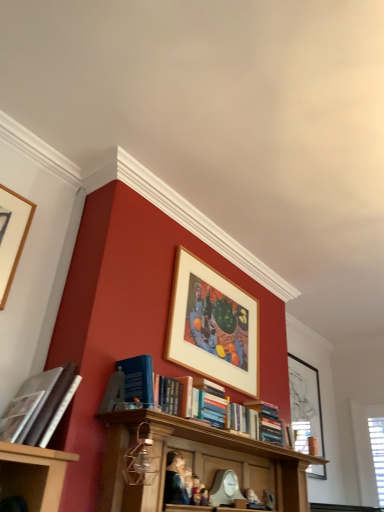
In order to face hardcover book at center, arranged as the 2th book when viewed from the top, should I rotate leftwards or rightwards?

Rotate right and turn 9.964 degrees.

Find the location of a particular element. Image resolution: width=384 pixels, height=512 pixels. black matte picture frame at upper right, which ranks as the 1th picture frame in right-to-left order is located at coordinates (305, 405).

Image resolution: width=384 pixels, height=512 pixels. What do you see at coordinates (175, 480) in the screenshot?
I see `smooth canvas portrait at center, positioned as the 2th person in right-to-left order` at bounding box center [175, 480].

What do you see at coordinates (198, 492) in the screenshot? This screenshot has height=512, width=384. I see `smooth plastic figurine at center, which appears as the first person when viewed from the right` at bounding box center [198, 492].

Where is `smooth plastic figurine at center, positioned as the 2th person in left-to-right order`? smooth plastic figurine at center, positioned as the 2th person in left-to-right order is located at coordinates (198, 492).

What are the coordinates of `hardcover book at center, arranged as the 2th book when viewed from the top` in the screenshot? It's located at (268, 421).

Is hardcover book at center, positioned as the first book in bottom-to-top order, shorter than wooden picture frame at upper center, the 2th picture frame in the back-to-front sequence?

Indeed, hardcover book at center, positioned as the first book in bottom-to-top order, has a lesser height compared to wooden picture frame at upper center, the 2th picture frame in the back-to-front sequence.

Does hardcover book at center, which is counted as the second book, starting from the left, have a smaller size compared to wooden picture frame at upper center, which is the second picture frame from front to back?

Correct, hardcover book at center, which is counted as the second book, starting from the left, occupies less space than wooden picture frame at upper center, which is the second picture frame from front to back.

Is point (272, 433) farther from camera compared to point (228, 340)?

No, (272, 433) is in front of (228, 340).

From the image's perspective, which one is positioned higher, hardcover book at center, which ranks as the first book in back-to-front order, or wooden picture frame at upper center, the 2th picture frame in the back-to-front sequence?

wooden picture frame at upper center, the 2th picture frame in the back-to-front sequence.

Does hardcover book at left, which is the 2th book in back-to-front order, contain black matte picture frame at upper right, which is counted as the 1th picture frame, starting from the back?

Definitely not — black matte picture frame at upper right, which is counted as the 1th picture frame, starting from the back, is not inside hardcover book at left, which is the 2th book in back-to-front order.

Considering the relative sizes of hardcover book at left, which is the 2th book in back-to-front order, and black matte picture frame at upper right, which ranks as the 1th picture frame in right-to-left order, in the image provided, is hardcover book at left, which is the 2th book in back-to-front order, thinner than black matte picture frame at upper right, which ranks as the 1th picture frame in right-to-left order,?

No, hardcover book at left, which is the 2th book in back-to-front order, is not thinner than black matte picture frame at upper right, which ranks as the 1th picture frame in right-to-left order.

Does point (45, 392) come closer to viewer compared to point (316, 396)?

Yes, point (45, 392) is closer to viewer.

From the image's perspective, which one is positioned higher, hardcover book at left, the 2th book viewed from the right, or black matte picture frame at upper right, which is counted as the 1th picture frame, starting from the back?

hardcover book at left, the 2th book viewed from the right.

From the picture: Between wooden picture frame at upper center, which is the second picture frame from front to back, and smooth plastic figurine at center, which appears as the first person when viewed from the right, which one has smaller size?

Smaller between the two is smooth plastic figurine at center, which appears as the first person when viewed from the right.

Consider the image. Is wooden picture frame at upper center, the 2th picture frame in the back-to-front sequence, oriented towards smooth plastic figurine at center, which appears as the first person when viewed from the right?

No, wooden picture frame at upper center, the 2th picture frame in the back-to-front sequence, is not facing towards smooth plastic figurine at center, which appears as the first person when viewed from the right.

Would you say wooden picture frame at upper center, which is the second picture frame from left to right, contains smooth plastic figurine at center, which appears as the first person when viewed from the right?

That's incorrect, smooth plastic figurine at center, which appears as the first person when viewed from the right, is not inside wooden picture frame at upper center, which is the second picture frame from left to right.

How many degrees apart are the facing directions of wooden picture frame at upper center, positioned as the second picture frame in right-to-left order, and smooth plastic figurine at center, positioned as the 2th person in left-to-right order?

The angle between the facing direction of wooden picture frame at upper center, positioned as the second picture frame in right-to-left order, and the facing direction of smooth plastic figurine at center, positioned as the 2th person in left-to-right order, is 0.684 degrees.

Considering the relative sizes of hardcover book at left, the 2th book ordered from the bottom, and smooth canvas portrait at center, acting as the 1th person starting from the left, in the image provided, is hardcover book at left, the 2th book ordered from the bottom, bigger than smooth canvas portrait at center, acting as the 1th person starting from the left,?

Yes.

Is hardcover book at left, which is the 2th book in back-to-front order, facing away from smooth canvas portrait at center, acting as the 1th person starting from the left?

No, hardcover book at left, which is the 2th book in back-to-front order,'s orientation is not away from smooth canvas portrait at center, acting as the 1th person starting from the left.

Which is correct: hardcover book at left, the 2th book ordered from the bottom, is inside smooth canvas portrait at center, positioned as the 2th person in right-to-left order, or outside of it?

The correct answer is: outside.

Can you see hardcover book at left, marked as the 1th book in a left-to-right arrangement, touching smooth canvas portrait at center, acting as the 1th person starting from the left?

No, hardcover book at left, marked as the 1th book in a left-to-right arrangement, is not making contact with smooth canvas portrait at center, acting as the 1th person starting from the left.

Are smooth plastic figurine at center, which appears as the first person when viewed from the right, and hardcover book at center, the 1th book viewed from the right, located far from each other?

smooth plastic figurine at center, which appears as the first person when viewed from the right, is near hardcover book at center, the 1th book viewed from the right, not far away.

Considering the relative sizes of smooth plastic figurine at center, which appears as the first person when viewed from the right, and hardcover book at center, which ranks as the first book in back-to-front order, in the image provided, is smooth plastic figurine at center, which appears as the first person when viewed from the right, smaller than hardcover book at center, which ranks as the first book in back-to-front order,?

Yes.

From a real-world perspective, who is located higher, smooth plastic figurine at center, positioned as the 2th person in left-to-right order, or hardcover book at center, arranged as the 2th book when viewed from the front?

From a 3D spatial view, hardcover book at center, arranged as the 2th book when viewed from the front, is above.

Are wooden picture frame at upper center, which is the second picture frame from left to right, and hardcover book at left, the 2th book ordered from the bottom, far apart?

wooden picture frame at upper center, which is the second picture frame from left to right, is actually quite close to hardcover book at left, the 2th book ordered from the bottom.

Is wooden picture frame at upper center, positioned as the second picture frame in right-to-left order, positioned beyond the bounds of hardcover book at left, which is the 2th book in back-to-front order?

Yes, wooden picture frame at upper center, positioned as the second picture frame in right-to-left order, is not within hardcover book at left, which is the 2th book in back-to-front order.

Consider the image. Is wooden picture frame at upper left, placed as the third picture frame when sorted from back to front, oriented away from smooth plastic figurine at center, which appears as the first person when viewed from the right?

wooden picture frame at upper left, placed as the third picture frame when sorted from back to front, does not have its back to smooth plastic figurine at center, which appears as the first person when viewed from the right.

Is wooden picture frame at upper left, the first picture frame from the top, wider than smooth plastic figurine at center, positioned as the 2th person in left-to-right order?

In fact, wooden picture frame at upper left, the first picture frame from the top, might be narrower than smooth plastic figurine at center, positioned as the 2th person in left-to-right order.

Is wooden picture frame at upper left, placed as the third picture frame when sorted from back to front, positioned behind smooth plastic figurine at center, positioned as the 2th person in left-to-right order?

No, wooden picture frame at upper left, placed as the third picture frame when sorted from back to front, is in front of smooth plastic figurine at center, positioned as the 2th person in left-to-right order.

Considering the sizes of wooden picture frame at upper left, placed as the third picture frame when sorted from back to front, and smooth plastic figurine at center, which appears as the first person when viewed from the right, in the image, is wooden picture frame at upper left, placed as the third picture frame when sorted from back to front, bigger or smaller than smooth plastic figurine at center, which appears as the first person when viewed from the right,?

In the image, wooden picture frame at upper left, placed as the third picture frame when sorted from back to front, appears to be larger than smooth plastic figurine at center, which appears as the first person when viewed from the right.

This screenshot has height=512, width=384. What are the coordinates of `book that is the 1st one below the wooden picture frame at upper center, the 2th picture frame in the back-to-front sequence (from a real-world perspective)` in the screenshot? It's located at (268, 421).

Locate an element on the screen. This screenshot has height=512, width=384. picture frame that is the 2nd object to the right of the hardcover book at left, which ranks as the first book in front-to-back order, starting at the anchor is located at coordinates (305, 405).

From the picture: Based on their spatial positions, is wooden picture frame at upper left, which is the 3th picture frame in right-to-left order, or smooth canvas portrait at center, acting as the 1th person starting from the left, closer to wooden picture frame at upper center, positioned as the second picture frame in right-to-left order?

smooth canvas portrait at center, acting as the 1th person starting from the left.

Looking at the image, which one is located further to smooth canvas portrait at center, positioned as the 2th person in right-to-left order, wooden picture frame at upper left, the first picture frame from the top, or hardcover book at left, the 2th book ordered from the bottom?

Among the two, wooden picture frame at upper left, the first picture frame from the top, is located further to smooth canvas portrait at center, positioned as the 2th person in right-to-left order.

Estimate the real-world distances between objects in this image. Which object is closer to wooden picture frame at upper center, which is the second picture frame from left to right, black matte picture frame at upper right, which is counted as the 1th picture frame, starting from the back, or smooth plastic figurine at center, positioned as the 2th person in left-to-right order?

Among the two, smooth plastic figurine at center, positioned as the 2th person in left-to-right order, is located nearer to wooden picture frame at upper center, which is the second picture frame from left to right.

Consider the image. When comparing their distances from smooth plastic figurine at center, which appears as the first person when viewed from the right, does hardcover book at center, arranged as the 2th book when viewed from the top, or smooth canvas portrait at center, positioned as the 2th person in right-to-left order, seem further?

hardcover book at center, arranged as the 2th book when viewed from the top, is further to smooth plastic figurine at center, which appears as the first person when viewed from the right.

Based on their spatial positions, is hardcover book at left, the 2th book viewed from the right, or black matte picture frame at upper right, which is counted as the 1th picture frame, starting from the back, further from smooth plastic figurine at center, which appears as the first person when viewed from the right?

black matte picture frame at upper right, which is counted as the 1th picture frame, starting from the back.

Which object lies nearer to the anchor point wooden picture frame at upper center, positioned as the second picture frame in right-to-left order, hardcover book at left, acting as the first book starting from the top, or hardcover book at center, which ranks as the first book in back-to-front order?

hardcover book at center, which ranks as the first book in back-to-front order, is positioned closer to the anchor wooden picture frame at upper center, positioned as the second picture frame in right-to-left order.

From the image, which object appears to be nearer to hardcover book at left, the 2th book ordered from the bottom, smooth plastic figurine at center, positioned as the 2th person in left-to-right order, or black matte picture frame at upper right, which is counted as the 1th picture frame, starting from the back?

smooth plastic figurine at center, positioned as the 2th person in left-to-right order, lies closer to hardcover book at left, the 2th book ordered from the bottom, than the other object.

Considering their positions, is wooden picture frame at upper center, which is the second picture frame from front to back, positioned further to black matte picture frame at upper right, which appears as the third picture frame when viewed from the top, than smooth canvas portrait at center, positioned as the 2th person in right-to-left order?

smooth canvas portrait at center, positioned as the 2th person in right-to-left order.

What are the coordinates of `person that lies between wooden picture frame at upper center, which is the second picture frame from left to right, and smooth plastic figurine at center, which appears as the first person when viewed from the right, from top to bottom` in the screenshot? It's located at (175, 480).

Locate an element on the screen. The height and width of the screenshot is (512, 384). person located between hardcover book at left, the 2th book ordered from the bottom, and smooth plastic figurine at center, which appears as the first person when viewed from the right, in the left-right direction is located at coordinates click(x=175, y=480).

Find the location of a particular element. Image resolution: width=384 pixels, height=512 pixels. book between smooth canvas portrait at center, acting as the 1th person starting from the left, and black matte picture frame at upper right, which ranks as the 1th picture frame in right-to-left order, from front to back is located at coordinates (268, 421).

Identify the location of book located between smooth plastic figurine at center, which appears as the first person when viewed from the right, and black matte picture frame at upper right, which appears as the first picture frame when ordered from the bottom, in the depth direction. tap(268, 421).